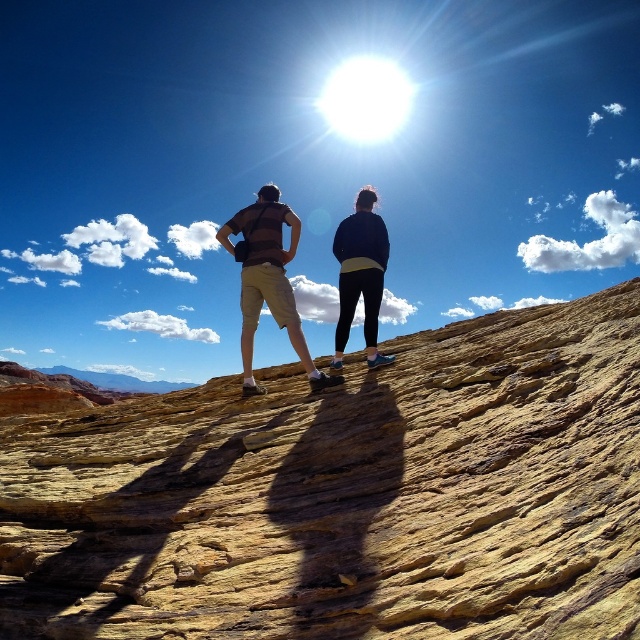
Is yellow sandstone at center smaller than dark blue fleece jacket at center?

Actually, yellow sandstone at center might be larger than dark blue fleece jacket at center.

In the scene shown: Who is shorter, yellow sandstone at center or dark blue fleece jacket at center?

yellow sandstone at center is shorter.

What are the coordinates of `yellow sandstone at center` in the screenshot? It's located at (348, 497).

The image size is (640, 640). I want to click on yellow sandstone at center, so click(x=348, y=497).

Is yellow sandstone at center to the left of matte beige shorts at center from the viewer's perspective?

In fact, yellow sandstone at center is to the right of matte beige shorts at center.

Based on the photo, can you confirm if yellow sandstone at center is shorter than matte beige shorts at center?

Yes.

Is point (237, 483) farther from viewer compared to point (259, 193)?

No, it is in front of (259, 193).

At what (x,y) coordinates should I click in order to perform the action: click on yellow sandstone at center. Please return your answer as a coordinate pair (x, y). Looking at the image, I should click on (348, 497).

Who is higher up, matte beige shorts at center or dark blue fleece jacket at center?

dark blue fleece jacket at center is above.

Who is taller, matte beige shorts at center or dark blue fleece jacket at center?

matte beige shorts at center is taller.

What do you see at coordinates (268, 280) in the screenshot?
I see `matte beige shorts at center` at bounding box center [268, 280].

Identify the location of matte beige shorts at center. (268, 280).